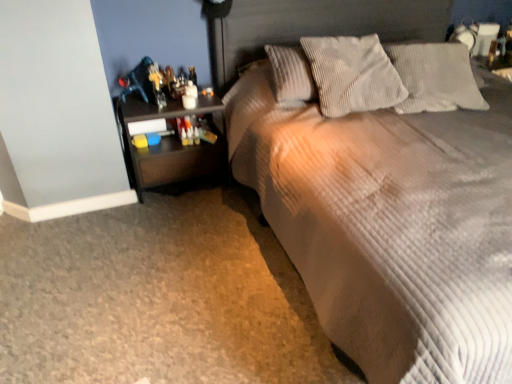
In order to face corduroy pillow at upper center, the first pillow from the left, should I rotate leftwards or rightwards?

Rotate your view right by about 13.129°.

Identify the location of corduroy fabric bed at center. Image resolution: width=512 pixels, height=384 pixels. (390, 225).

Where is `dark wood nightstand at left`? This screenshot has width=512, height=384. dark wood nightstand at left is located at coordinates (170, 145).

What is the approximate width of dark wood nightstand at left?

dark wood nightstand at left is 15.23 inches wide.

The height and width of the screenshot is (384, 512). I want to click on corduroy pillow at upper center, which is the second pillow from right to left, so click(352, 74).

Is gray corduroy pillow at upper center, the 2th pillow when ordered from left to right, at the left side of corduroy pillow at upper center, the first pillow from the left?

No.

Considering the sizes of objects gray corduroy pillow at upper center, the 2th pillow when ordered from left to right, and corduroy pillow at upper center, which is the second pillow from right to left, in the image provided, who is bigger, gray corduroy pillow at upper center, the 2th pillow when ordered from left to right, or corduroy pillow at upper center, which is the second pillow from right to left,?

With larger size is corduroy pillow at upper center, which is the second pillow from right to left.

Is gray corduroy pillow at upper center, which is the first pillow from right to left, positioned with its back to corduroy pillow at upper center, which is the second pillow from right to left?

No, corduroy pillow at upper center, which is the second pillow from right to left, is not at the back of gray corduroy pillow at upper center, which is the first pillow from right to left.

In order to click on pillow that is above the gray corduroy pillow at upper center, the 2th pillow when ordered from left to right (from the image's perspective) in this screenshot , I will do `click(352, 74)`.

Based on the photo, does corduroy pillow at upper center, the first pillow from the left, have a lesser height compared to corduroy fabric bed at center?

Yes, corduroy pillow at upper center, the first pillow from the left, is shorter than corduroy fabric bed at center.

How different are the orientations of corduroy pillow at upper center, the first pillow from the left, and corduroy fabric bed at center in degrees?

The angle between the facing direction of corduroy pillow at upper center, the first pillow from the left, and the facing direction of corduroy fabric bed at center is 2.11 degrees.

From a real-world perspective, between corduroy pillow at upper center, the first pillow from the left, and corduroy fabric bed at center, who is vertically lower?

corduroy fabric bed at center is physically lower.

Which of these two, corduroy pillow at upper center, the first pillow from the left, or corduroy fabric bed at center, is thinner?

Thinner between the two is corduroy pillow at upper center, the first pillow from the left.

Which of these two, corduroy fabric bed at center or dark wood nightstand at left, is smaller?

Smaller between the two is dark wood nightstand at left.

Considering the relative sizes of corduroy fabric bed at center and dark wood nightstand at left in the image provided, is corduroy fabric bed at center thinner than dark wood nightstand at left?

No, corduroy fabric bed at center is not thinner than dark wood nightstand at left.

Between corduroy fabric bed at center and dark wood nightstand at left, which one is positioned behind?

dark wood nightstand at left is further away from the camera.

Could you tell me if corduroy pillow at upper center, the first pillow from the left, is facing dark wood nightstand at left?

No, corduroy pillow at upper center, the first pillow from the left, is not facing towards dark wood nightstand at left.

Is corduroy pillow at upper center, which is the second pillow from right to left, positioned in front of dark wood nightstand at left?

That is True.

Can you confirm if corduroy pillow at upper center, the first pillow from the left, is positioned to the left of dark wood nightstand at left?

Incorrect, corduroy pillow at upper center, the first pillow from the left, is not on the left side of dark wood nightstand at left.

What's the angular difference between corduroy pillow at upper center, the first pillow from the left, and dark wood nightstand at left's facing directions?

The angle between the facing direction of corduroy pillow at upper center, the first pillow from the left, and the facing direction of dark wood nightstand at left is 2.4 degrees.

From the image's perspective, does gray corduroy pillow at upper center, which is the first pillow from right to left, appear higher than corduroy fabric bed at center?

Yes, from the image's perspective, gray corduroy pillow at upper center, which is the first pillow from right to left, is on top of corduroy fabric bed at center.

Considering the positions of point (430, 102) and point (489, 168), is point (430, 102) closer or farther from the camera than point (489, 168)?

Clearly, point (430, 102) is more distant from the camera than point (489, 168).

Is gray corduroy pillow at upper center, which is the first pillow from right to left, to the left or to the right of corduroy fabric bed at center in the image?

gray corduroy pillow at upper center, which is the first pillow from right to left, is positioned on corduroy fabric bed at center's right side.

From a real-world perspective, between gray corduroy pillow at upper center, which is the first pillow from right to left, and corduroy fabric bed at center, who is vertically higher?

Result: gray corduroy pillow at upper center, which is the first pillow from right to left, is physically above.

Can you confirm if gray corduroy pillow at upper center, which is the first pillow from right to left, is smaller than dark wood nightstand at left?

Yes.

Is gray corduroy pillow at upper center, the 2th pillow when ordered from left to right, inside or outside of dark wood nightstand at left?

gray corduroy pillow at upper center, the 2th pillow when ordered from left to right, lies outside dark wood nightstand at left.

Looking at this image, from the image's perspective, is gray corduroy pillow at upper center, which is the first pillow from right to left, on dark wood nightstand at left?

Yes, from the image's perspective, gray corduroy pillow at upper center, which is the first pillow from right to left, is on top of dark wood nightstand at left.

Which point is more forward, (122, 124) or (440, 195)?

Point (440, 195)

How much distance is there between dark wood nightstand at left and corduroy fabric bed at center?

They are 27.66 inches apart.

Does dark wood nightstand at left have a smaller size compared to corduroy fabric bed at center?

Yes, dark wood nightstand at left is smaller than corduroy fabric bed at center.

From their relative heights in the image, would you say dark wood nightstand at left is taller or shorter than corduroy fabric bed at center?

Clearly, dark wood nightstand at left is shorter compared to corduroy fabric bed at center.

Locate an element on the screen. This screenshot has width=512, height=384. pillow in front of the gray corduroy pillow at upper center, which is the first pillow from right to left is located at coordinates (352, 74).

Find the location of a particular element. The height and width of the screenshot is (384, 512). bed that is under the corduroy pillow at upper center, the first pillow from the left (from a real-world perspective) is located at coordinates (390, 225).

From the image, which object appears to be farther from corduroy pillow at upper center, the first pillow from the left, dark wood nightstand at left or corduroy fabric bed at center?

Among the two, dark wood nightstand at left is located further to corduroy pillow at upper center, the first pillow from the left.

From the image, which object appears to be farther from corduroy pillow at upper center, which is the second pillow from right to left, corduroy fabric bed at center or dark wood nightstand at left?

Among the two, dark wood nightstand at left is located further to corduroy pillow at upper center, which is the second pillow from right to left.

When comparing their distances from corduroy fabric bed at center, does corduroy pillow at upper center, which is the second pillow from right to left, or gray corduroy pillow at upper center, which is the first pillow from right to left, seem further?

Based on the image, gray corduroy pillow at upper center, which is the first pillow from right to left, appears to be further to corduroy fabric bed at center.

Considering their positions, is gray corduroy pillow at upper center, which is the first pillow from right to left, positioned further to dark wood nightstand at left than corduroy fabric bed at center?

gray corduroy pillow at upper center, which is the first pillow from right to left.

Looking at the image, which one is located closer to corduroy fabric bed at center, gray corduroy pillow at upper center, which is the first pillow from right to left, or corduroy pillow at upper center, which is the second pillow from right to left?

Among the two, corduroy pillow at upper center, which is the second pillow from right to left, is located nearer to corduroy fabric bed at center.

Based on the photo, from the image, which object appears to be nearer to corduroy pillow at upper center, the first pillow from the left, gray corduroy pillow at upper center, the 2th pillow when ordered from left to right, or dark wood nightstand at left?

gray corduroy pillow at upper center, the 2th pillow when ordered from left to right, lies closer to corduroy pillow at upper center, the first pillow from the left, than the other object.

Considering their positions, is corduroy pillow at upper center, which is the second pillow from right to left, positioned closer to dark wood nightstand at left than corduroy fabric bed at center?

corduroy fabric bed at center is positioned closer to the anchor dark wood nightstand at left.

Which object lies nearer to the anchor point gray corduroy pillow at upper center, the 2th pillow when ordered from left to right, dark wood nightstand at left or corduroy fabric bed at center?

Among the two, corduroy fabric bed at center is located nearer to gray corduroy pillow at upper center, the 2th pillow when ordered from left to right.

Find the location of a particular element. pillow between corduroy fabric bed at center and gray corduroy pillow at upper center, the 2th pillow when ordered from left to right, along the z-axis is located at coordinates (352, 74).

Locate an element on the screen. pillow between dark wood nightstand at left and gray corduroy pillow at upper center, which is the first pillow from right to left, from left to right is located at coordinates (352, 74).